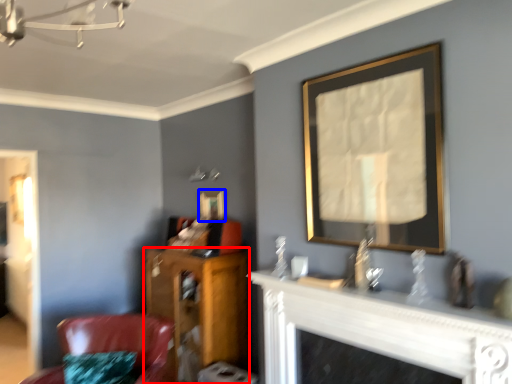
Question: Which point is further to the camera, furniture (highlighted by a red box) or picture frame (highlighted by a blue box)?

Choices:
 (A) furniture
 (B) picture frame

Answer: (B)